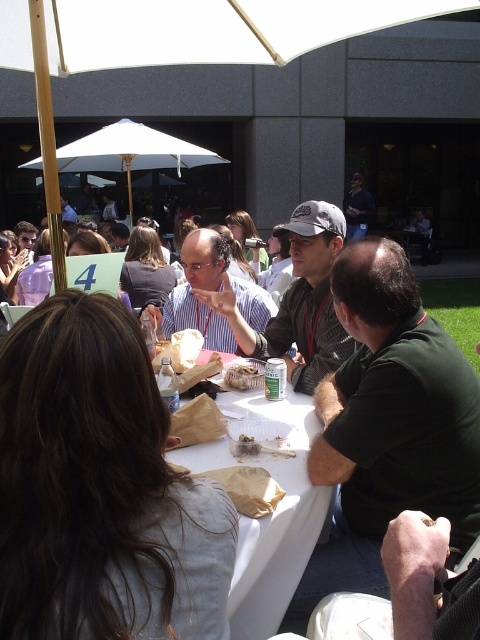
Question: Which object is the farthest from the dark blue shirt at center?

Choices:
 (A) matte white shirt at center
 (B) white paper table at center
 (C) dark green shirt at center
 (D) brown paper bag at table

Answer: (D)

Question: Which point appears farthest from the camera in this image?

Choices:
 (A) (x=245, y=452)
 (B) (x=132, y=221)
 (C) (x=228, y=365)
 (D) (x=354, y=211)

Answer: (D)

Question: Which point is closer to the camera?

Choices:
 (A) (214, 250)
 (B) (87, 156)
 (C) (286, 332)

Answer: (C)

Question: Does white fabric umbrella at upper center have a larger size compared to brown paper bag at table?

Choices:
 (A) no
 (B) yes

Answer: (B)

Question: Is white fabric umbrella at upper center to the right of dark blue shirt at center from the viewer's perspective?

Choices:
 (A) yes
 (B) no

Answer: (B)

Question: From the image, what is the correct spatial relationship of white paper table at center in relation to crumbly brown bread at table center?

Choices:
 (A) right
 (B) left

Answer: (A)